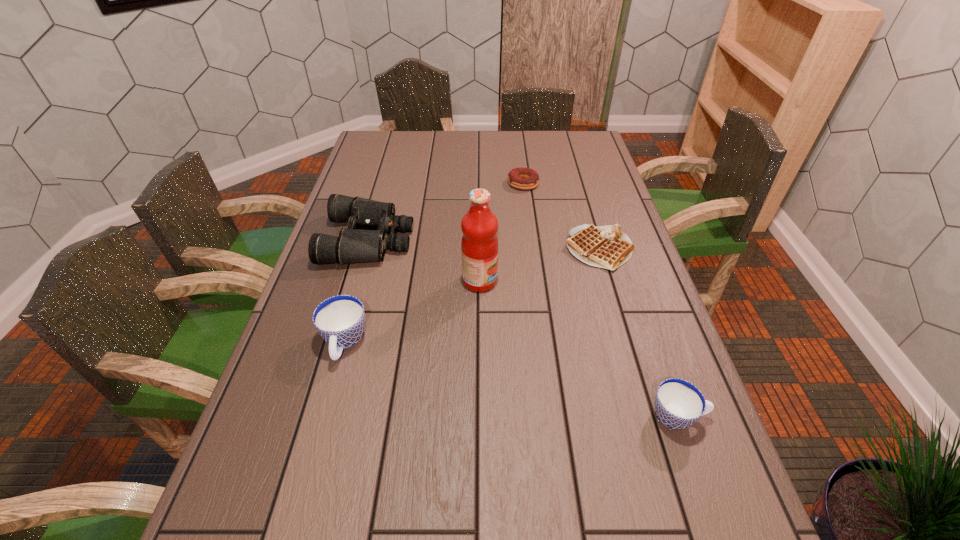
In the image, there is a desktop. At what (x,y) coordinates should I click in order to perform the action: click on blank space at the left edge. Please return your answer as a coordinate pair (x, y). The height and width of the screenshot is (540, 960). Looking at the image, I should click on (291, 362).

In order to click on free space at the right edge in this screenshot , I will do `click(603, 184)`.

Where is `free space at the far left corner of the desktop`? The width and height of the screenshot is (960, 540). free space at the far left corner of the desktop is located at coordinates (400, 145).

At what (x,y) coordinates should I click in order to perform the action: click on vacant point located between the waffle and the third object from left to right. Please return your answer as a coordinate pair (x, y). Looking at the image, I should click on (540, 265).

Find the location of a particular element. The image size is (960, 540). blank region between the fruit juice and the waffle is located at coordinates (540, 265).

The height and width of the screenshot is (540, 960). Find the location of `free spot between the binoculars and the third object from left to right`. free spot between the binoculars and the third object from left to right is located at coordinates (424, 260).

Locate an element on the screen. The height and width of the screenshot is (540, 960). vacant area between the waffle and the second nearest object is located at coordinates (472, 296).

This screenshot has height=540, width=960. Identify the location of empty space between the fourth object from left to right and the tallest object. (501, 232).

Locate an element on the screen. free spot between the farther cup and the third object from left to right is located at coordinates [x=412, y=312].

This screenshot has width=960, height=540. I want to click on vacant region between the right cup and the waffle, so click(638, 333).